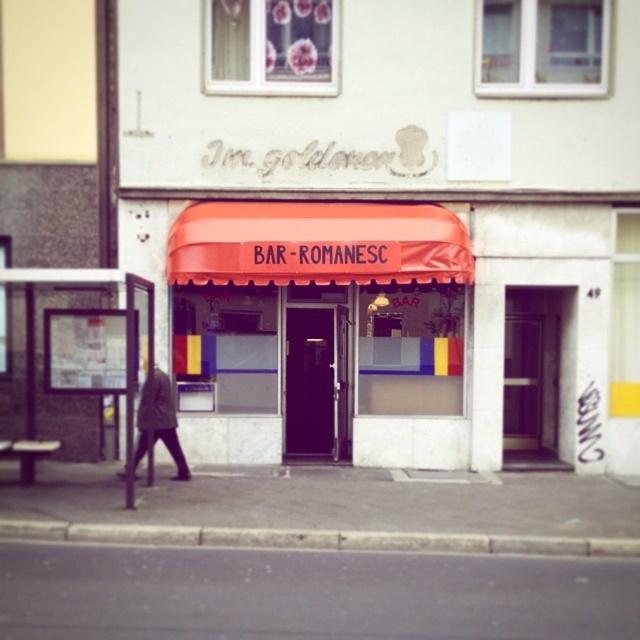
Which is above, orange fabric awning at center or black asphalt at lower center?

orange fabric awning at center

Between orange fabric awning at center and black asphalt at lower center, which one appears on the right side from the viewer's perspective?

Positioned to the right is orange fabric awning at center.

This screenshot has width=640, height=640. What are the coordinates of `orange fabric awning at center` in the screenshot? It's located at (390, 224).

How far apart are black asphalt at lower center and dark gray coat at left?

The distance of black asphalt at lower center from dark gray coat at left is 3.50 meters.

Consider the image. Does black asphalt at lower center have a greater width compared to dark gray coat at left?

Yes.

Image resolution: width=640 pixels, height=640 pixels. What are the coordinates of `black asphalt at lower center` in the screenshot? It's located at 308,593.

Is gray concrete pavement at lower center positioned before dark gray coat at left?

Yes, gray concrete pavement at lower center is closer to the viewer.

Does point (19, 492) lie behind point (173, 449)?

That is False.

Find the location of a particular element. The image size is (640, 640). gray concrete pavement at lower center is located at coordinates coord(328,500).